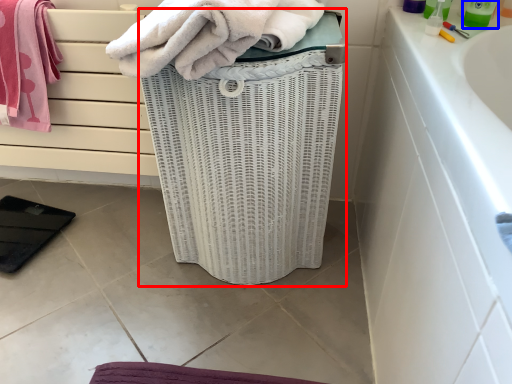
Question: Which object is closer to the camera taking this photo, basket container (highlighted by a red box) or cleaning product (highlighted by a blue box)?

Choices:
 (A) basket container
 (B) cleaning product

Answer: (A)